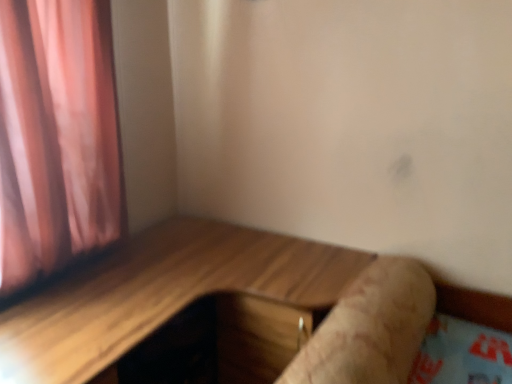
Measure the distance between wooden table at center and camera.

The distance of wooden table at center from camera is 3.53 feet.

This screenshot has width=512, height=384. Identify the location of wooden table at center. (160, 293).

Image resolution: width=512 pixels, height=384 pixels. Describe the element at coordinates (160, 293) in the screenshot. I see `wooden table at center` at that location.

The height and width of the screenshot is (384, 512). I want to click on brown textured log at lower right, so click(370, 328).

Image resolution: width=512 pixels, height=384 pixels. What do you see at coordinates (370, 328) in the screenshot?
I see `brown textured log at lower right` at bounding box center [370, 328].

This screenshot has height=384, width=512. I want to click on wooden table at center, so click(160, 293).

Consider the image. Which object is positioned more to the left, brown textured log at lower right or wooden table at center?

From the viewer's perspective, wooden table at center appears more on the left side.

Does brown textured log at lower right come behind wooden table at center?

That is True.

Which is nearer, [390,326] or [357,255]?

The point [390,326] is more forward.

From the image's perspective, is brown textured log at lower right located above wooden table at center?

Yes, from the image's perspective, brown textured log at lower right is on top of wooden table at center.

From a real-world perspective, is brown textured log at lower right physically located above or below wooden table at center?

From a real-world perspective, brown textured log at lower right is physically above wooden table at center.

Does brown textured log at lower right have a greater width compared to wooden table at center?

No.

From their relative heights in the image, would you say brown textured log at lower right is taller or shorter than wooden table at center?

Considering their sizes, brown textured log at lower right has less height than wooden table at center.

Who is bigger, brown textured log at lower right or wooden table at center?

wooden table at center is bigger.

Is brown textured log at lower right situated inside wooden table at center or outside?

brown textured log at lower right is not inside wooden table at center, it's outside.

Would you consider brown textured log at lower right to be distant from wooden table at center?

No, brown textured log at lower right is not far from wooden table at center.

Is wooden table at center at the back of brown textured log at lower right?

Yes, brown textured log at lower right's orientation is away from wooden table at center.

Measure the distance from brown textured log at lower right to wooden table at center.

A distance of 36.67 centimeters exists between brown textured log at lower right and wooden table at center.

Locate an element on the screen. log above the wooden table at center (from the image's perspective) is located at coordinates (370, 328).

Visually, is wooden table at center positioned to the left or to the right of brown textured log at lower right?

In the image, wooden table at center appears on the left side of brown textured log at lower right.

Which object is further away from the camera, wooden table at center or brown textured log at lower right?

brown textured log at lower right is behind.

Is point (28, 314) in front of point (409, 320)?

No, it is not.

From the image's perspective, which one is positioned lower, wooden table at center or brown textured log at lower right?

wooden table at center appears lower in the image.

From a real-world perspective, which object stands above the other?

brown textured log at lower right is physically above.

Considering the sizes of wooden table at center and brown textured log at lower right in the image, is wooden table at center wider or thinner than brown textured log at lower right?

In the image, wooden table at center appears to be wider than brown textured log at lower right.

Considering the sizes of objects wooden table at center and brown textured log at lower right in the image provided, who is shorter, wooden table at center or brown textured log at lower right?

With less height is brown textured log at lower right.

Between wooden table at center and brown textured log at lower right, which one has larger size?

With larger size is wooden table at center.

Can brown textured log at lower right be found inside wooden table at center?

No, brown textured log at lower right is not a part of wooden table at center.

Is wooden table at center far from brown textured log at lower right?

No, wooden table at center is in close proximity to brown textured log at lower right.

Consider the image. Could you tell me if wooden table at center is turned towards brown textured log at lower right?

Yes, wooden table at center is aimed at brown textured log at lower right.

Can you tell me how much wooden table at center and brown textured log at lower right differ in facing direction?

They differ by 2.69 degrees in their facing directions.

Where is `log behind the wooden table at center`? The image size is (512, 384). log behind the wooden table at center is located at coordinates (370, 328).

Where is `log located behind the wooden table at center`? log located behind the wooden table at center is located at coordinates (370, 328).

Identify the location of table that appears below the brown textured log at lower right (from the image's perspective). (160, 293).